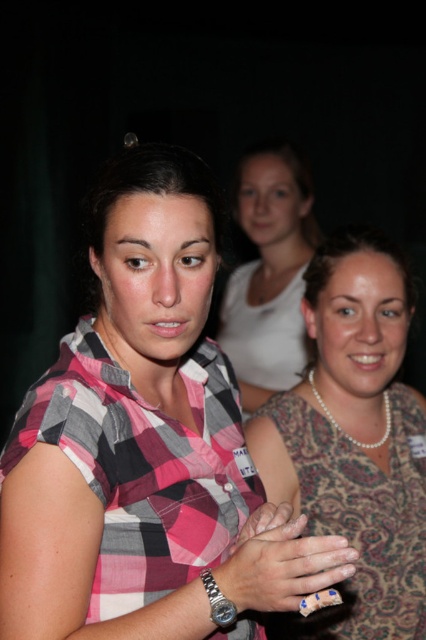
Question: Does patterned fabric dress at center lie in front of smooth skin hand at center?

Choices:
 (A) no
 (B) yes

Answer: (A)

Question: Is patterned fabric dress at center above white matte tank top at center?

Choices:
 (A) yes
 (B) no

Answer: (B)

Question: Considering the real-world distances, which object is closest to the pink plaid shirt at center?

Choices:
 (A) blue painted fingernails at center
 (B) smooth skin hand at center

Answer: (A)

Question: Which object is positioned closest to the white matte tank top at center?

Choices:
 (A) patterned fabric dress at center
 (B) pink plaid shirt at center
 (C) smooth skin hand at center
 (D) blue painted fingernails at center

Answer: (A)

Question: Is white matte tank top at center bigger than blue painted fingernails at center?

Choices:
 (A) no
 (B) yes

Answer: (B)

Question: Which point appears closest to the camera in this image?

Choices:
 (A) (379, 376)
 (B) (166, 156)

Answer: (B)